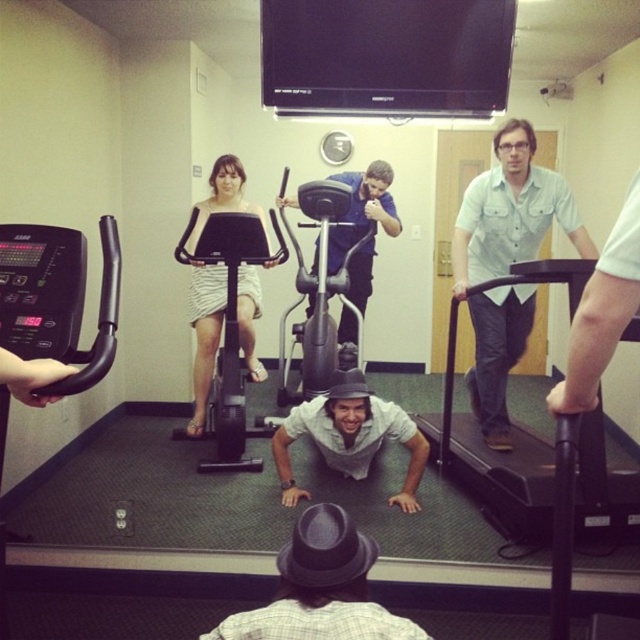
You are standing in the gym and want to place a small potted plant between the black rubber treadmill at right and the white textured dress at center. Based on their sizes, which object should the plant be closer to?

The black rubber treadmill at right is larger in size than the white textured dress at center, so the plant should be placed closer to the white textured dress at center to maintain balance between the two objects.

You are a person trying to reach a water bottle placed on the black rubber treadmill at right. You are currently standing next to the gray cotton shirt at center. Considering the height difference between the treadmill and the shirt, will you need to bend down or reach up to grab the water bottle?

The black rubber treadmill at right is taller than the gray cotton shirt at center, so you will need to reach up to grab the water bottle placed on the black rubber treadmill at right.

Looking at this image, you are a person standing at the entrance of the gym. You want to place a gray felt fedora at center on top of the black rubber treadmill at right. Is this possible based on their sizes?

The black rubber treadmill at right is much taller than the gray felt fedora at center. Since the treadmill is taller, placing the fedora on top would be possible as it can sit on the elevated surface.